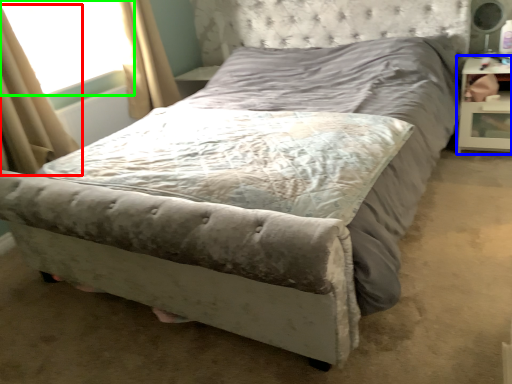
Question: Which object is positioned farthest from curtain (highlighted by a red box)? Select from nightstand (highlighted by a blue box) and window screen (highlighted by a green box).

Choices:
 (A) nightstand
 (B) window screen

Answer: (A)